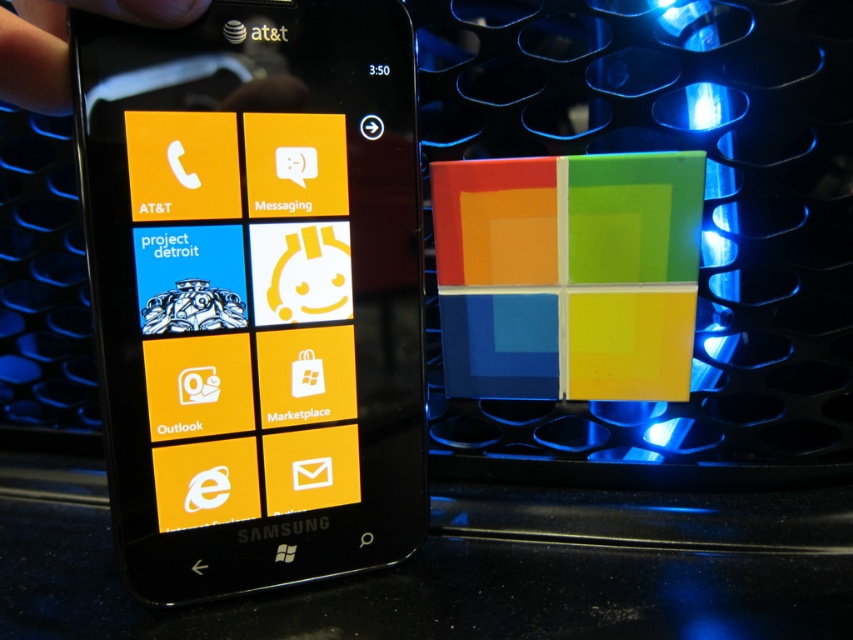
Does point (416, 330) come in front of point (27, 22)?

No, it is not.

Does black glossy smartphone at left have a lesser width compared to black matte hand at upper left?

Incorrect, black glossy smartphone at left's width is not less than black matte hand at upper left's.

Which is in front, point (346, 492) or point (54, 72)?

Point (54, 72) is in front.

Locate an element on the screen. black glossy smartphone at left is located at coordinates (254, 291).